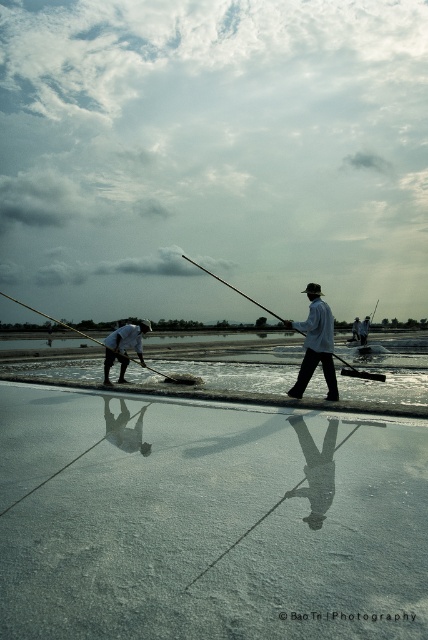
You are a photographer planning to capture the two workers in the salt pan scene. You need to ensure both the white matte fisherman at lower left and the wooden pole at left are visible in your shot. Given their sizes, which object will appear smaller in the photo?

The white matte fisherman at lower left appears smaller in the photo because its width is less than the wooden pole at left.

You are a photographer standing at the edge of the salt pan. You want to take a photo of the white matte fisherman at lower left and the wooden pole at left. Which object is closer to you?

The white matte fisherman at lower left is closer to you because the wooden pole at left is behind the fisherman.